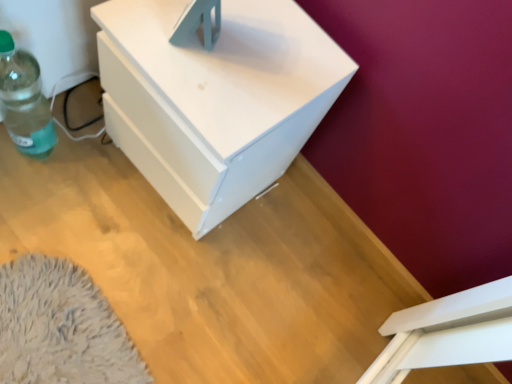
Locate an element on the screen. vacant area that lies between white matte nightstand at center and green translucent bottle at left is located at coordinates (102, 173).